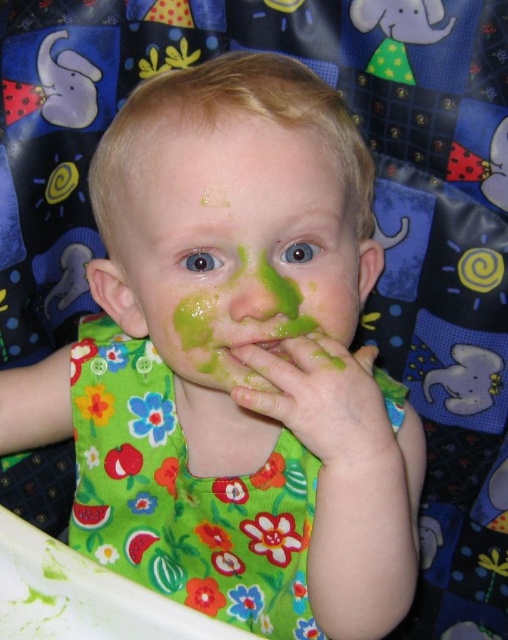
Question: Among these objects, which one is nearest to the camera?

Choices:
 (A) green matte face at center
 (B) green matte/solid mouth at center
 (C) green fabric bib at center

Answer: (A)

Question: Can you confirm if green fabric bib at center is positioned above green matte/solid mouth at center?

Choices:
 (A) yes
 (B) no

Answer: (B)

Question: Can you confirm if green fabric bib at center is positioned to the right of green matte hand at center?

Choices:
 (A) yes
 (B) no

Answer: (B)

Question: Can you confirm if green matte hand at center is thinner than green matte/solid mouth at center?

Choices:
 (A) yes
 (B) no

Answer: (B)

Question: Based on their relative distances, which object is farther from the green matte/solid mouth at center?

Choices:
 (A) green fabric bib at center
 (B) green matte face at center

Answer: (A)

Question: Among these points, which one is farthest from the camera?

Choices:
 (A) (376, 413)
 (B) (280, 452)
 (C) (248, 355)
 (D) (166, 328)

Answer: (B)